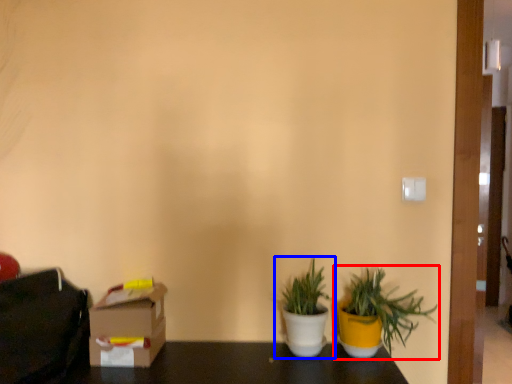
Question: Among these objects, which one is nearest to the camera, houseplant (highlighted by a red box) or houseplant (highlighted by a blue box)?

Choices:
 (A) houseplant
 (B) houseplant

Answer: (A)